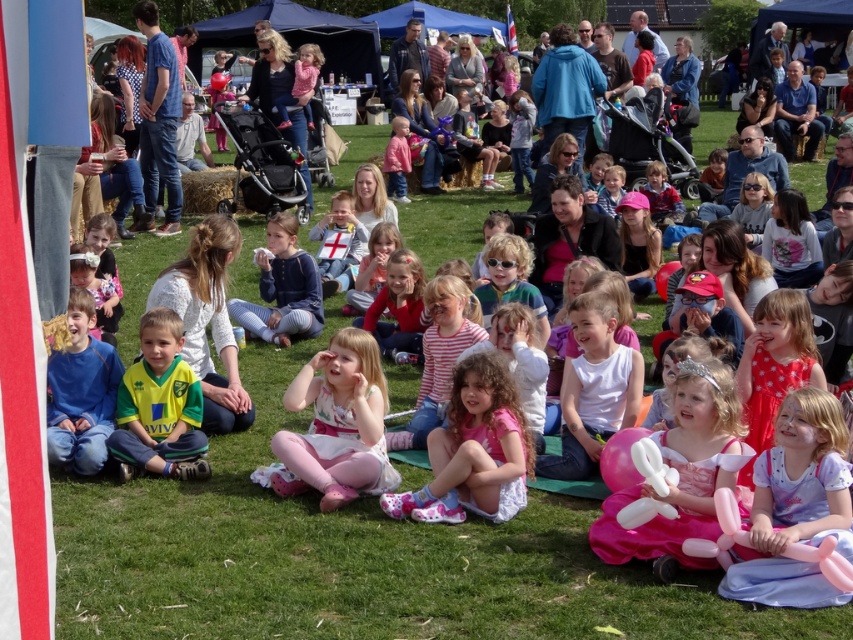
Question: Does pink fabric dress at center have a larger size compared to green jersey at center?

Choices:
 (A) yes
 (B) no

Answer: (A)

Question: Is pink satin dress at center behind pink fabric dress at center?

Choices:
 (A) yes
 (B) no

Answer: (A)

Question: Which point is farther to the camera?

Choices:
 (A) green jersey at center
 (B) pink satin dress at center
 (C) blue striped pants at center
 (D) pink rubber balloon animal at lower right

Answer: (C)

Question: Among these objects, which one is nearest to the camera?

Choices:
 (A) pink rubber balloon animal at lower right
 (B) blue striped pants at center

Answer: (A)

Question: Does green jersey at center appear over blue striped pants at center?

Choices:
 (A) yes
 (B) no

Answer: (B)

Question: Estimate the real-world distances between objects in this image. Which object is farther from the blue striped pants at center?

Choices:
 (A) pink rubber balloon animal at lower right
 (B) pink satin dress at center
 (C) blue cotton shirt at lower left

Answer: (A)